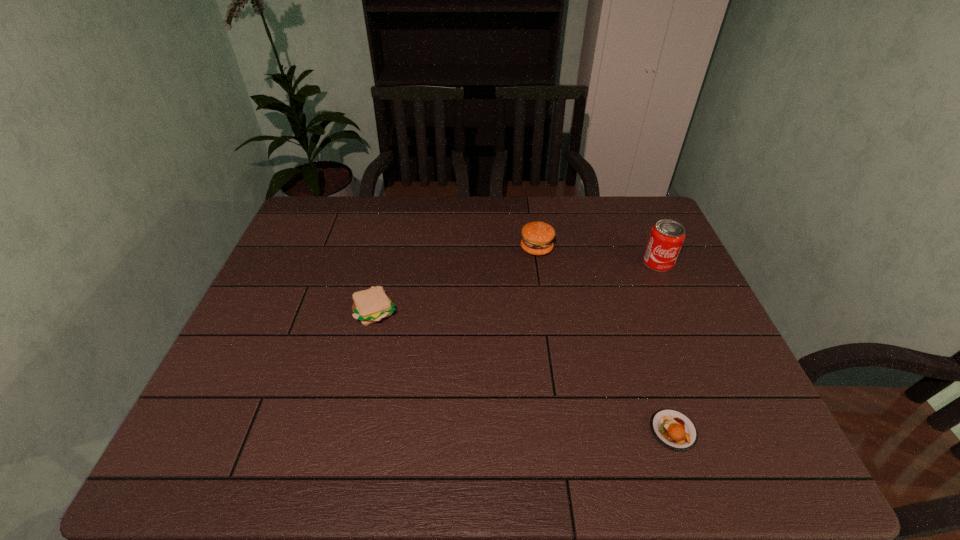
In the image, there is a desktop. Identify the location of free space at the far left corner. This screenshot has width=960, height=540. (295, 234).

Identify the location of blank area at the far right corner. (636, 216).

In the image, there is a desktop. Where is `free space at the near right corner`? The width and height of the screenshot is (960, 540). free space at the near right corner is located at coordinates (757, 442).

Find the location of a particular element. Image resolution: width=960 pixels, height=540 pixels. free space between the second farthest patty (food) and the can is located at coordinates (517, 287).

The width and height of the screenshot is (960, 540). In order to click on vacant space in between the leftmost object and the can in this screenshot , I will do `click(517, 287)`.

You are a GUI agent. You are given a task and a screenshot of the screen. Output one action in this format:
    pyautogui.click(x=<x>, y=<y>)
    Task: Click on the free space between the tallest object and the second tallest patty (food)
    Image resolution: width=960 pixels, height=540 pixels.
    Given the screenshot: What is the action you would take?
    pyautogui.click(x=517, y=287)

Where is `free area in between the second nearest object and the shortest patty (food)`? free area in between the second nearest object and the shortest patty (food) is located at coordinates (525, 371).

Where is `free space between the leftmost object and the rightmost patty (food)`? This screenshot has width=960, height=540. free space between the leftmost object and the rightmost patty (food) is located at coordinates (525, 371).

Find the location of `free space between the third object from right to left and the nearest patty (food)`. free space between the third object from right to left and the nearest patty (food) is located at coordinates (605, 339).

In order to click on free area in between the nearest patty (food) and the second nearest patty (food) in this screenshot , I will do `click(525, 371)`.